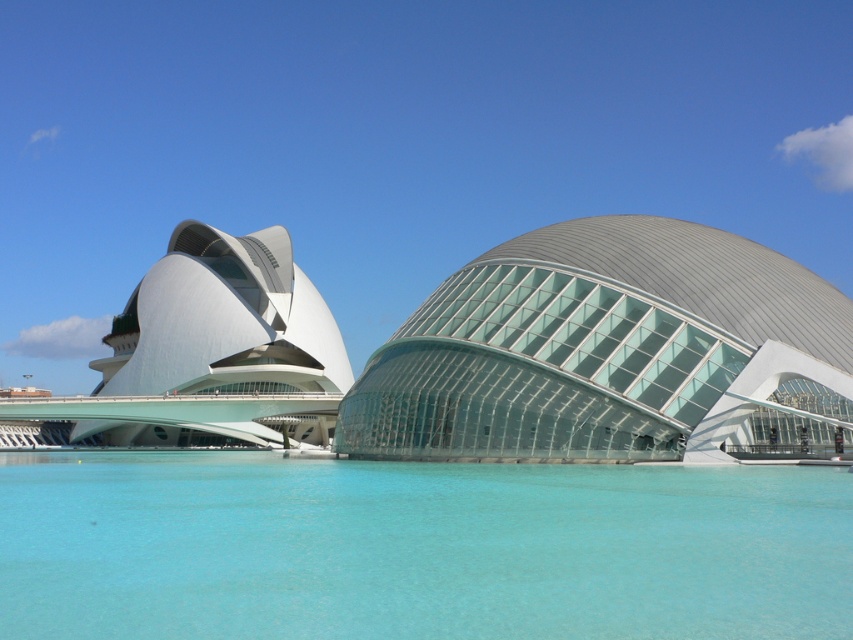
Question: Observing the image, what is the correct spatial positioning of clear blue water at lower center in reference to transparent glass dome at center?

Choices:
 (A) right
 (B) left

Answer: (B)

Question: In this image, where is clear blue water at lower center located relative to transparent glass dome at center?

Choices:
 (A) left
 (B) right

Answer: (A)

Question: Which point is farther from the camera taking this photo?

Choices:
 (A) (281, 461)
 (B) (695, 394)

Answer: (A)

Question: Can you confirm if clear blue water at lower center is positioned to the right of transparent glass dome at center?

Choices:
 (A) no
 (B) yes

Answer: (A)